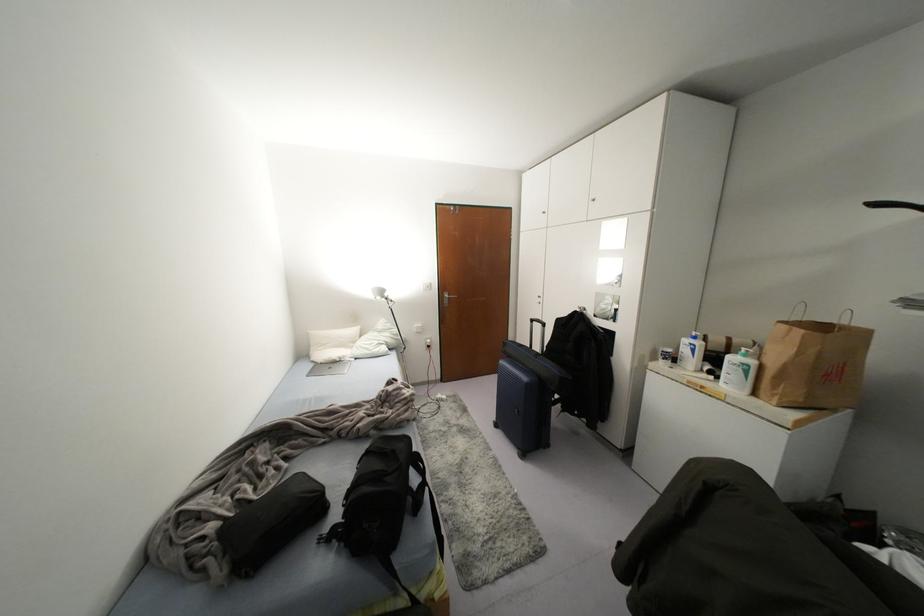
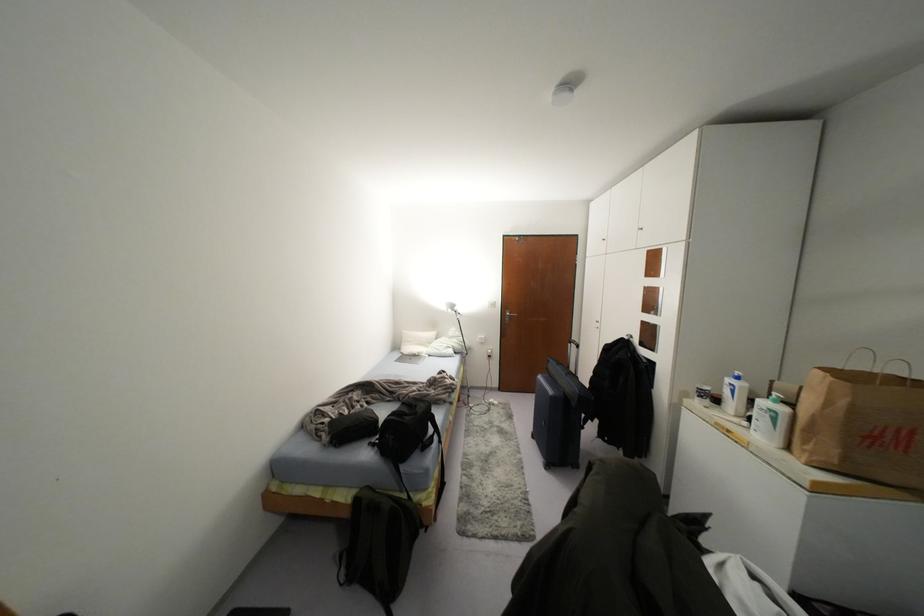
Question: The images are taken continuously from a first-person perspective. In which direction is your viewpoint rotating?

Choices:
 (A) Left
 (B) Right
 (C) Up
 (D) Down

Answer: (A)